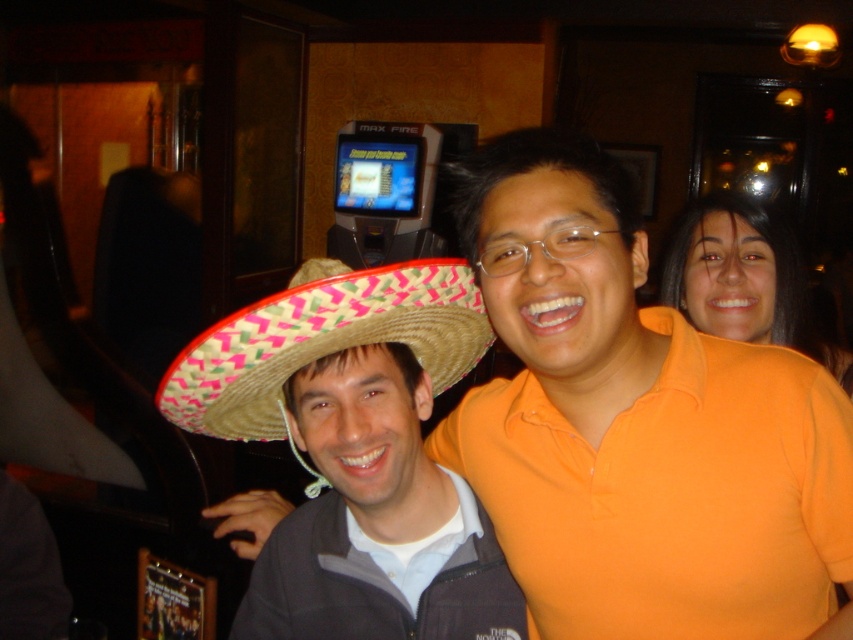
You are at a party and want to take a photo with both the bright pink woven straw sombrero at center and the orange matte shirt at upper right in the frame. Based on their distance, will they both fit in a standard smartphone camera frame that can capture objects up to 30 inches apart?

The bright pink woven straw sombrero at center is 28.85 inches away from the orange matte shirt at upper right, which is within the 30 inches limit of the smartphone camera frame. Therefore, both objects will fit in the frame.

You are at a party and want to grab the straw hat at center. Your hand can reach 70 centimeters. Can you reach it?

The straw hat at center is 77.53 centimeters away from you, which is beyond your hand reach of 70 centimeters. You cannot reach it.